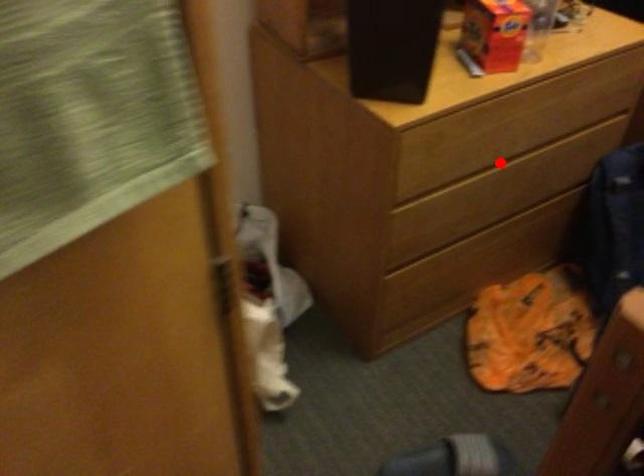
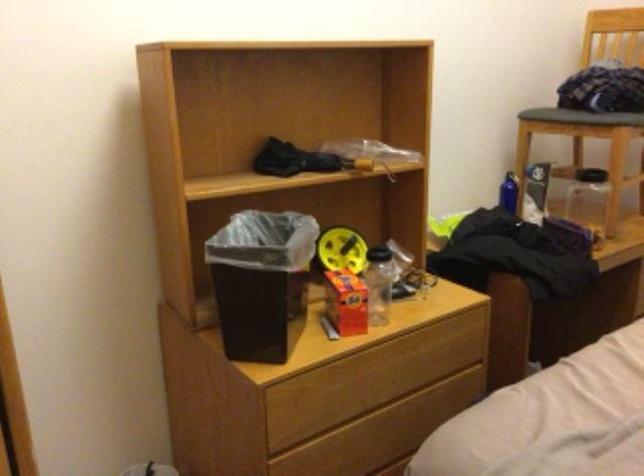
Question: I am providing you with two images of the same scene from different viewpoints. Image1 has a red point marked. In image2, the corresponding 3D location appears at what relative position? Reply with the corresponding letter.

Choices:
 (A) Closer
 (B) Farther

Answer: (B)